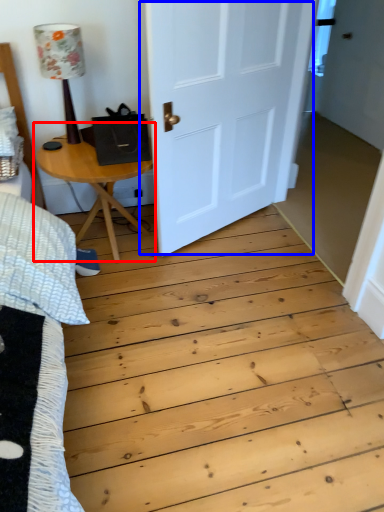
Question: Among these objects, which one is farthest to the camera, table (highlighted by a red box) or door (highlighted by a blue box)?

Choices:
 (A) table
 (B) door

Answer: (A)